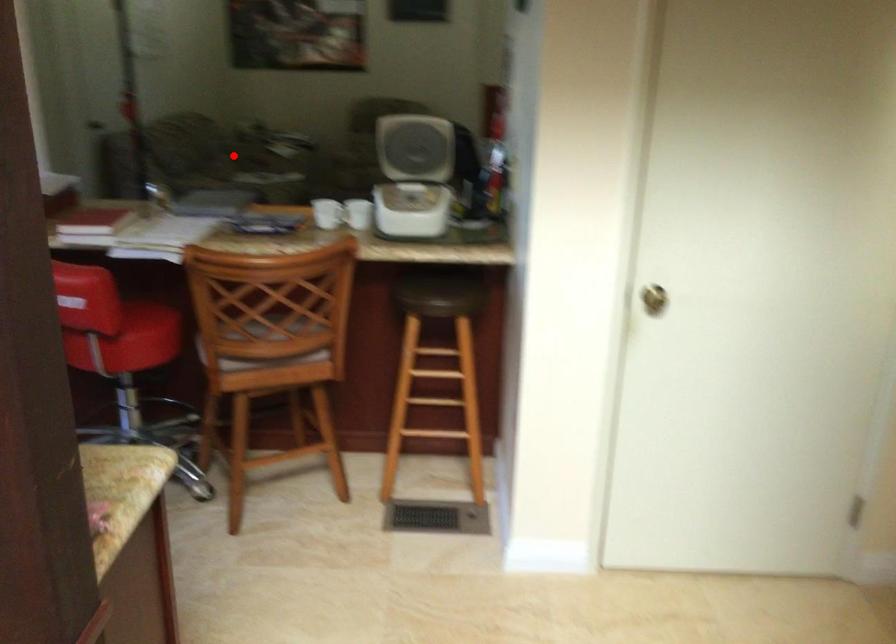
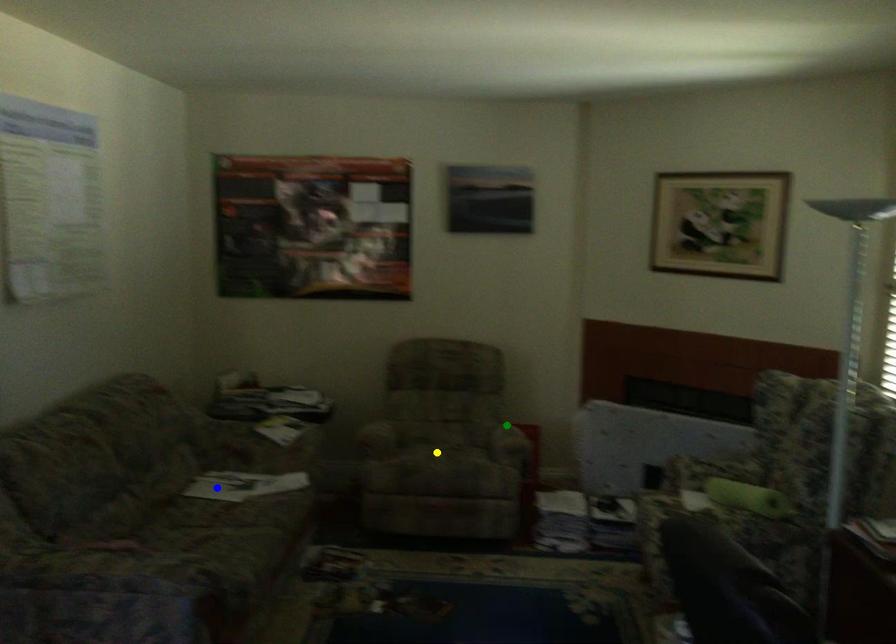
Question: I am providing you with two images of the same scene from different viewpoints. A red point is marked on the first image. You are given multiple points on the second image. Which mark in image 2 goes with the point in image 1?

Choices:
 (A) blue point
 (B) yellow point
 (C) green point

Answer: (A)